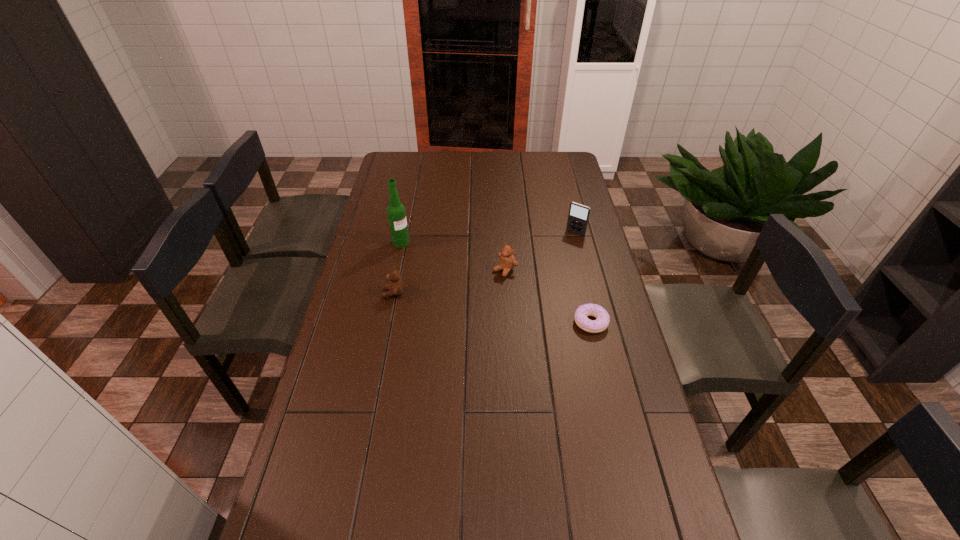
You are a GUI agent. You are given a task and a screenshot of the screen. Output one action in this format:
    pyautogui.click(x=<x>, y=<y>)
    Task: Click on the vacant space located 0.270m on the label of the second farthest object
    
    Given the screenshot: What is the action you would take?
    pyautogui.click(x=454, y=280)

Find the location of a particular element. The height and width of the screenshot is (540, 960). teddy bear present at the left edge is located at coordinates (395, 288).

Where is `beer bottle positioned at the left edge`? This screenshot has height=540, width=960. beer bottle positioned at the left edge is located at coordinates (396, 213).

I want to click on doughnut located at the right edge, so click(x=602, y=320).

Find the location of a particular element. Image resolution: width=960 pixels, height=540 pixels. iPod located in the right edge section of the desktop is located at coordinates (578, 217).

In the image, there is a desktop. Identify the location of vacant space at the far edge. This screenshot has height=540, width=960. (529, 174).

Locate an element on the screen. vacant space at the near edge of the desktop is located at coordinates (566, 510).

The width and height of the screenshot is (960, 540). Find the location of `free space at the left edge`. free space at the left edge is located at coordinates (333, 437).

The width and height of the screenshot is (960, 540). I want to click on free location at the right edge of the desktop, so click(x=617, y=370).

In order to click on free space at the near right corner in this screenshot , I will do `click(658, 500)`.